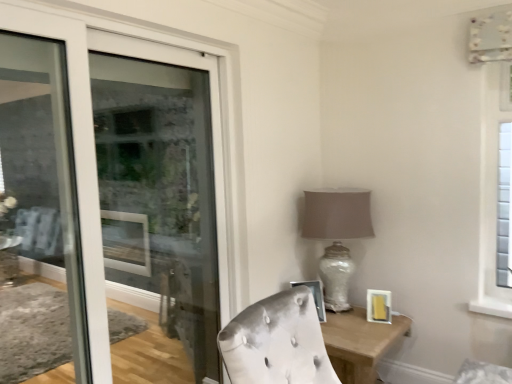
Where is `empty space that is ontop of matte glass door at left`? This screenshot has width=512, height=384. empty space that is ontop of matte glass door at left is located at coordinates (144, 26).